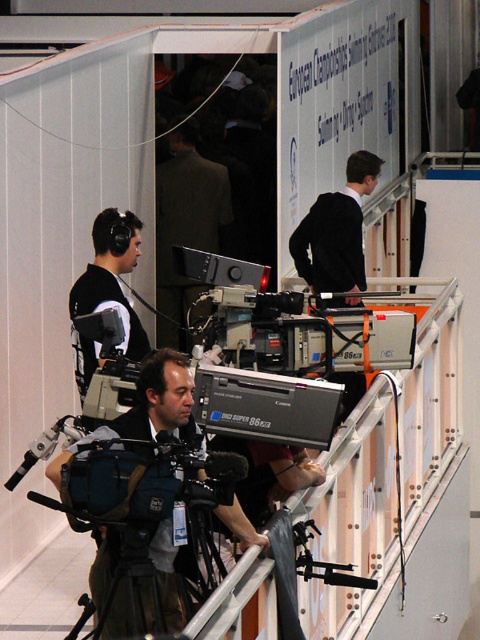
You are a technician at the event and need to place a protective cover over the matte black camera at center and the dark gray suit at center. Which object requires a larger cover?

The dark gray suit at center requires a larger cover since the matte black camera at center is smaller in size compared to it.

You are a technician at the event and need to place both the dark gray suit at center and the black matte headphones at left on a shelf. The shelf has a height limit of 1 meter. Can both items be placed on the shelf without exceeding the height limit?

The dark gray suit at center is taller than the black matte headphones at left. Since the shelf has a height limit of 1 meter, both items can be placed on the shelf as long as their individual heights do not exceed the limit. However, without specific measurements, it is impossible to confirm if they fit. Please check the actual dimensions of both items.